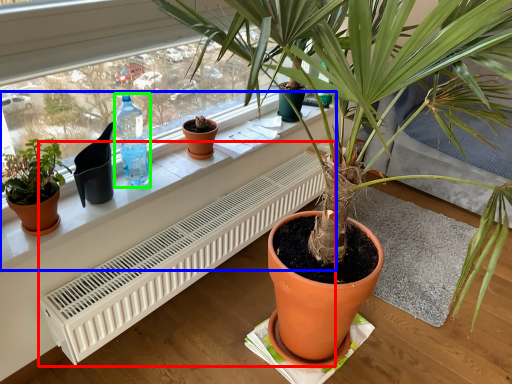
Question: Which object is the farthest from air conditioner (highlighted by a red box)? Choose among these: window sill (highlighted by a blue box) or bottle (highlighted by a green box).

Choices:
 (A) window sill
 (B) bottle

Answer: (B)